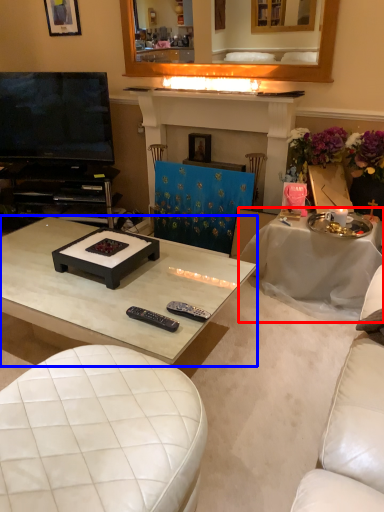
Question: Which point is further to the camera, table (highlighted by a red box) or coffee table (highlighted by a blue box)?

Choices:
 (A) table
 (B) coffee table

Answer: (A)